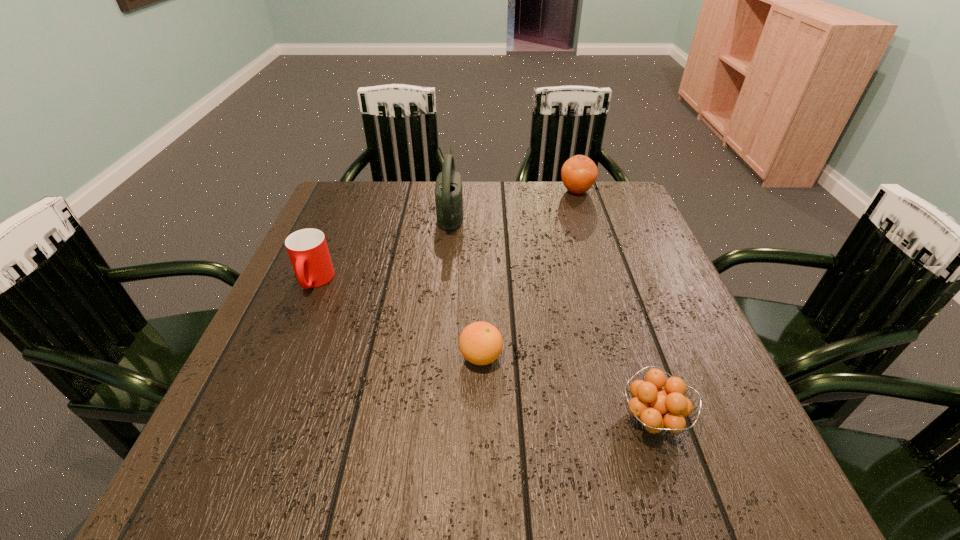
Find the location of a particular element. This screenshot has height=540, width=960. free point that satisfies the following two spatial constraints: 1. on the spout of the nearest object; 2. on the left side of the second object from left to right is located at coordinates (432, 420).

Where is `free space that satisfies the following two spatial constraints: 1. on the back side of the tallest orange; 2. on the right side of the third object from left to right`? free space that satisfies the following two spatial constraints: 1. on the back side of the tallest orange; 2. on the right side of the third object from left to right is located at coordinates (481, 191).